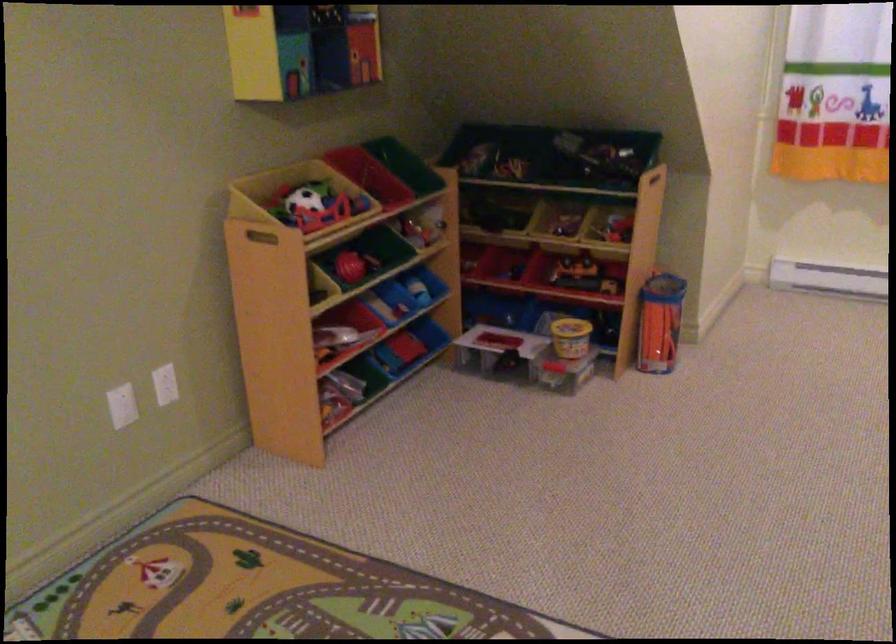
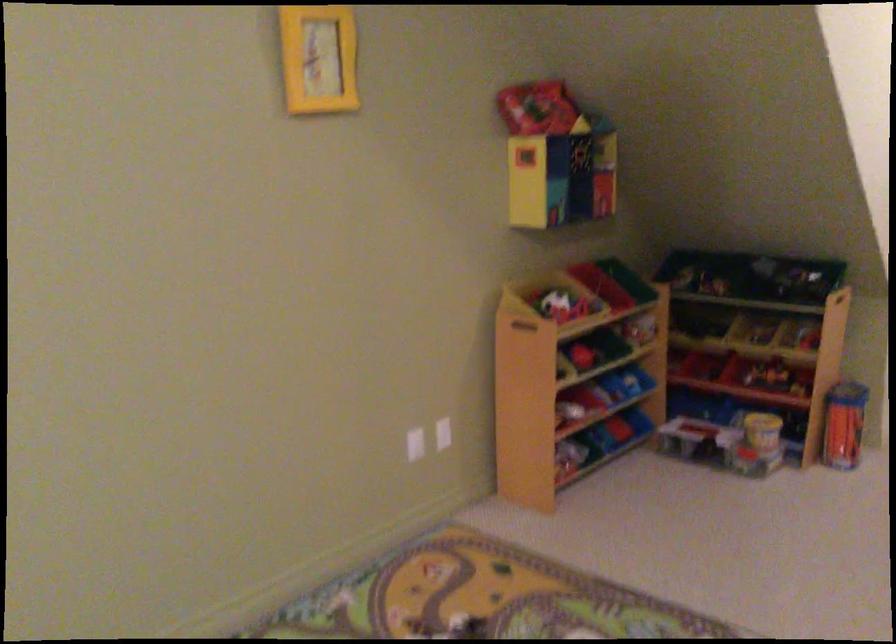
The point at (262,234) is marked in the first image. Where is the corresponding point in the second image?

(519, 321)